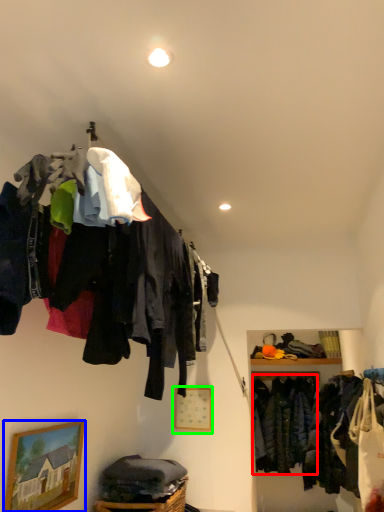
Question: Considering the real-world distances, which object is closest to clothing (highlighted by a red box)? picture frame (highlighted by a blue box) or picture frame (highlighted by a green box).

Choices:
 (A) picture frame
 (B) picture frame

Answer: (B)